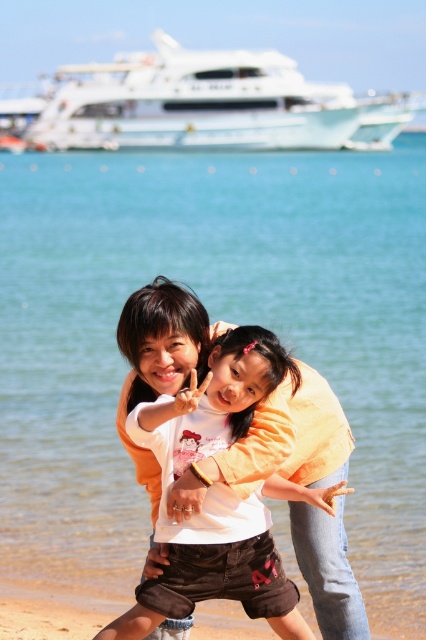
You are a photographer standing at the beach scene. You want to capture a photo that includes both the white glossy boat at upper center and the matte orange shirt at center. Given that your camera has a maximum focus range of 100 meters, will you be able to get both objects in focus at the same time?

The white glossy boat at upper center and the matte orange shirt at center are 106.63 meters apart from each other. Since the distance exceeds the camera maximum focus range of 100 meters, you won exceed the camera maximum focus range of 100 meters, so you cannot get both objects in focus at the same time.

You are a photographer trying to capture the matte orange shirt at center and the white glossy boat at upper center in the same frame. Which object should you adjust your camera focus to first to ensure both are in focus?

The matte orange shirt at center is behind the white glossy boat at upper center, so you should focus on the white glossy boat at upper center first to ensure both are in focus.